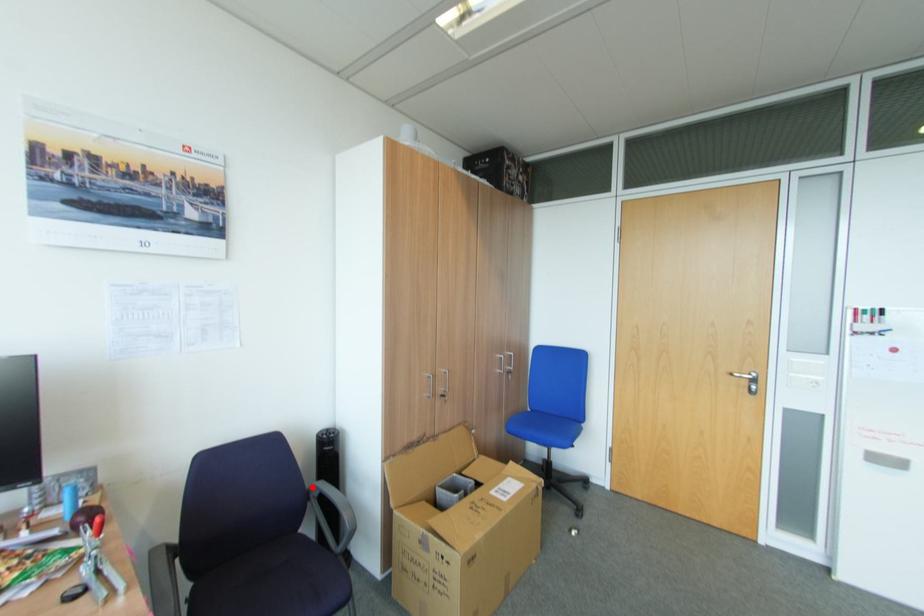
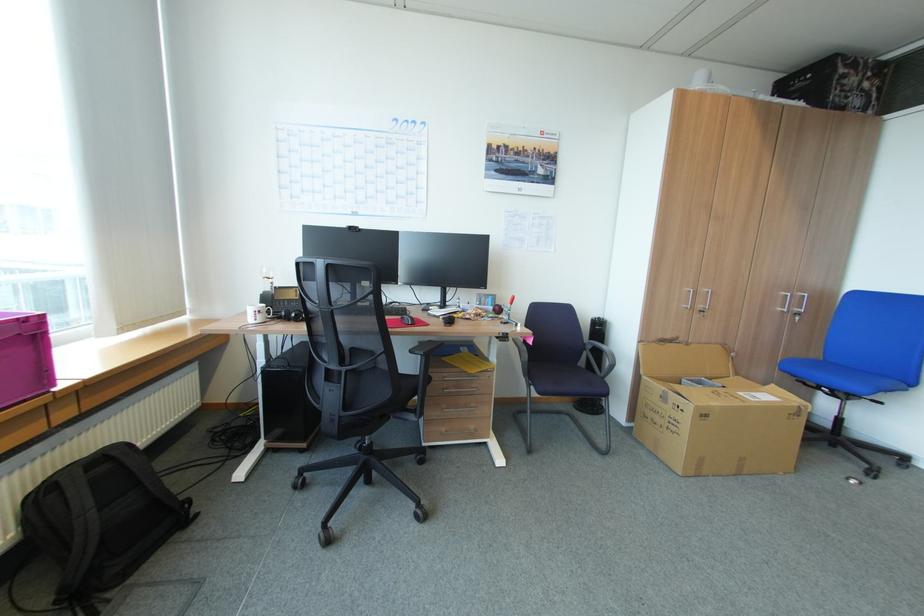
Find the pixel in the second image that matches the highlighted location in the first image.

(590, 342)